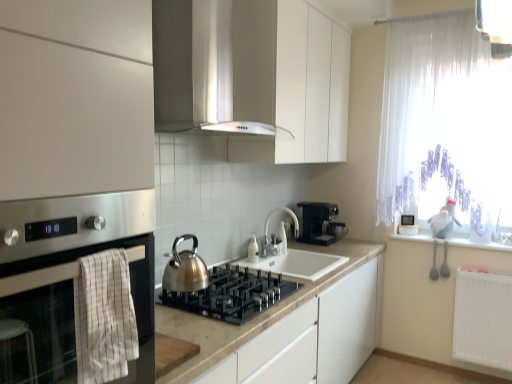
The height and width of the screenshot is (384, 512). In order to click on free space above white plastic radiator at lower right (from a real-world perspective) in this screenshot , I will do `click(489, 269)`.